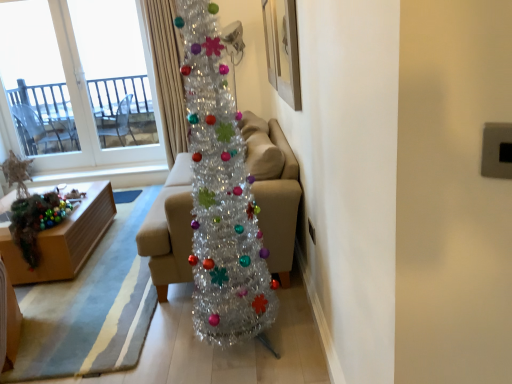
At what (x,y) coordinates should I click in order to perform the action: click on free space that is to the left of shiny metallic christmas tree at center. Please return your answer as a coordinate pair (x, y). This screenshot has width=512, height=384. Looking at the image, I should click on (156, 338).